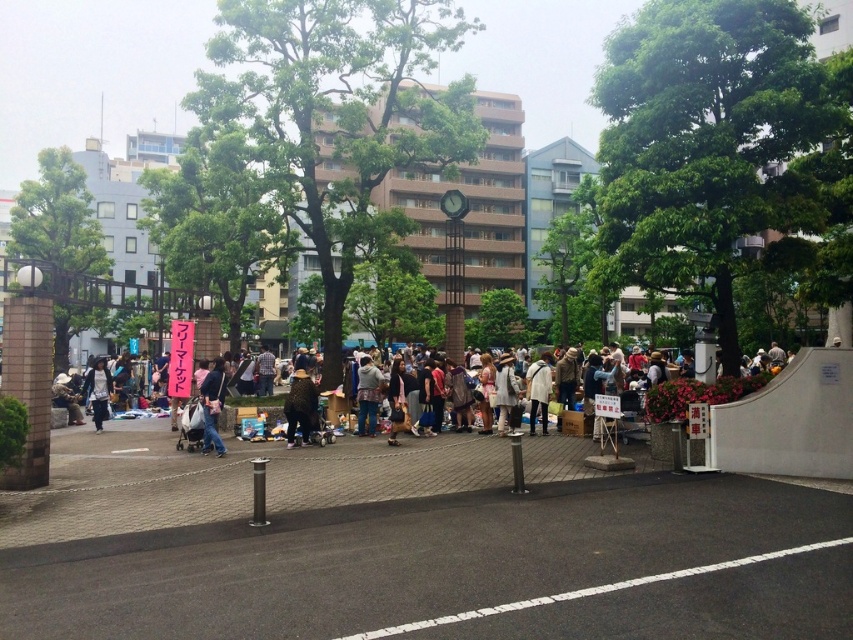
Question: Does leopard print coat at center have a larger size compared to matte black bag at center?

Choices:
 (A) yes
 (B) no

Answer: (B)

Question: Does white fuzzy jacket at center have a smaller size compared to denim jacket at center?

Choices:
 (A) no
 (B) yes

Answer: (B)

Question: Is matte black bag at center to the left of denim jacket at center from the viewer's perspective?

Choices:
 (A) no
 (B) yes

Answer: (A)

Question: Which of the following is the farthest from the observer?

Choices:
 (A) (102, 376)
 (B) (370, 634)

Answer: (A)

Question: Which of the following is the farthest from the observer?

Choices:
 (A) (102, 385)
 (B) (611, 592)

Answer: (A)

Question: Which object appears closest to the camera in this image?

Choices:
 (A) denim jacket at center
 (B) matte black bag at center

Answer: (B)